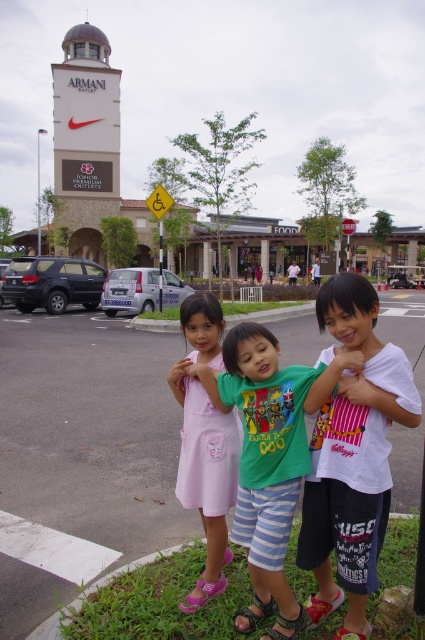
Question: Does white cotton shirt at center lie in front of yellow plastic handicap sign at upper center?

Choices:
 (A) yes
 (B) no

Answer: (A)

Question: Which point is closer to the camera?

Choices:
 (A) pos(74,161)
 (B) pos(243,536)
 (C) pos(340,419)

Answer: (C)

Question: Which is farther from the green cotton shirt at center?

Choices:
 (A) asphalt pavement at center
 (B) pink fabric dress at center
 (C) yellow plastic handicap sign at upper center
 (D) white cotton shirt at center

Answer: (C)

Question: Which of the following is the farthest from the observer?

Choices:
 (A) click(107, 132)
 (B) click(311, 557)
 (C) click(282, 456)
 (D) click(167, 195)

Answer: (A)

Question: Can you confirm if white cotton shirt at center is positioned to the left of green cotton shirt at center?

Choices:
 (A) yes
 (B) no

Answer: (B)

Question: Does asphalt pavement at center appear under yellow plastic handicap sign at upper center?

Choices:
 (A) no
 (B) yes

Answer: (B)